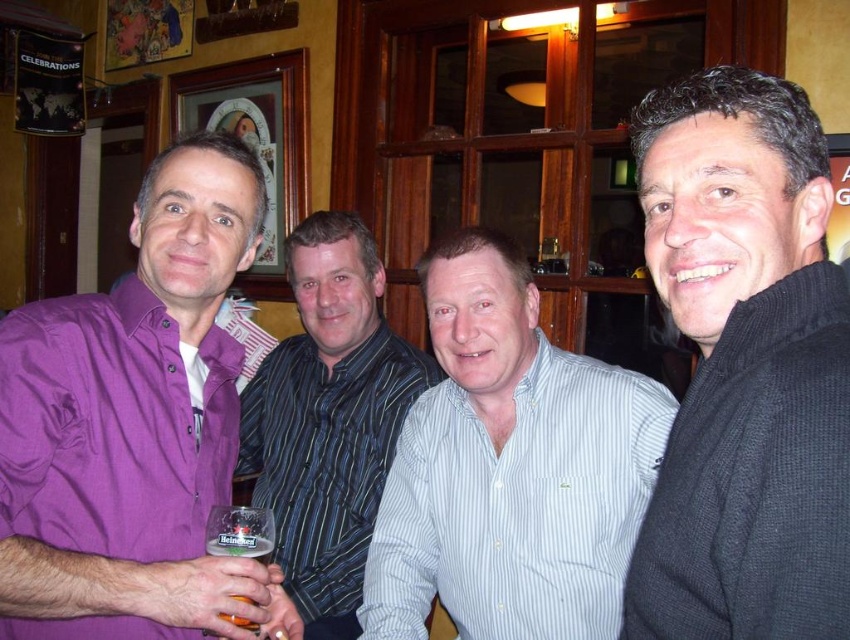
You are a photographer standing in front of the group. You need to adjust your camera to focus on the purple cotton shirt at left and the translucent plastic beer glass at lower left. Which object should you focus on first if you want to ensure both are in focus without moving the camera?

The purple cotton shirt at left is much taller than the translucent plastic beer glass at lower left, so focusing on the closer object first would be better. However, since the shirt is taller, it might be farther away. Wait, actually, in depth of field terms, if the shirt is taller, it might be further away, so focusing on the closer beer glass first would help both be in focus.

You are a photographer trying to capture a clear shot of the light blue striped shirt at center without the black wool sweater at right blocking it. What should you do?

The black wool sweater at right is positioned over the light blue striped shirt at center, so you should move your camera angle slightly to the left to avoid the sweater blocking the view of the light blue striped shirt at center.